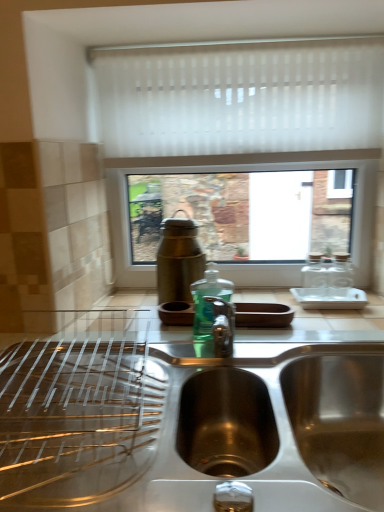
Question: Considering the relative positions of stainless steel sink at center and white sheer curtain at upper center in the image provided, is stainless steel sink at center to the right of white sheer curtain at upper center from the viewer's perspective?

Choices:
 (A) no
 (B) yes

Answer: (A)

Question: Is stainless steel sink at center oriented away from white sheer curtain at upper center?

Choices:
 (A) no
 (B) yes

Answer: (A)

Question: Can you confirm if stainless steel sink at center is smaller than white sheer curtain at upper center?

Choices:
 (A) no
 (B) yes

Answer: (A)

Question: Is white sheer curtain at upper center surrounded by stainless steel sink at center?

Choices:
 (A) yes
 (B) no

Answer: (B)

Question: Is stainless steel sink at center behind white sheer curtain at upper center?

Choices:
 (A) yes
 (B) no

Answer: (B)

Question: From a real-world perspective, does stainless steel sink at center sit lower than white sheer curtain at upper center?

Choices:
 (A) yes
 (B) no

Answer: (A)

Question: Does white sheer curtain at upper center have a smaller size compared to stainless steel sink at center?

Choices:
 (A) no
 (B) yes

Answer: (B)

Question: Are white sheer curtain at upper center and stainless steel sink at center located far from each other?

Choices:
 (A) no
 (B) yes

Answer: (A)

Question: Is the depth of white sheer curtain at upper center greater than that of stainless steel sink at center?

Choices:
 (A) no
 (B) yes

Answer: (B)

Question: Is white sheer curtain at upper center to the right of stainless steel sink at center from the viewer's perspective?

Choices:
 (A) yes
 (B) no

Answer: (A)

Question: From a real-world perspective, is white sheer curtain at upper center physically below stainless steel sink at center?

Choices:
 (A) yes
 (B) no

Answer: (B)

Question: Is white sheer curtain at upper center turned away from stainless steel sink at center?

Choices:
 (A) no
 (B) yes

Answer: (A)

Question: Is white sheer curtain at upper center spatially inside stainless steel sink at center, or outside of it?

Choices:
 (A) outside
 (B) inside

Answer: (A)